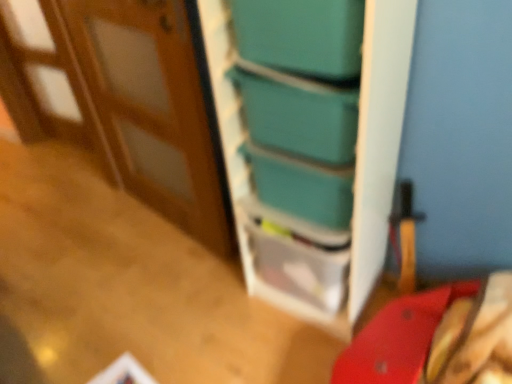
I want to click on free point above smooth red table at lower right (from a real-world perspective), so click(150, 325).